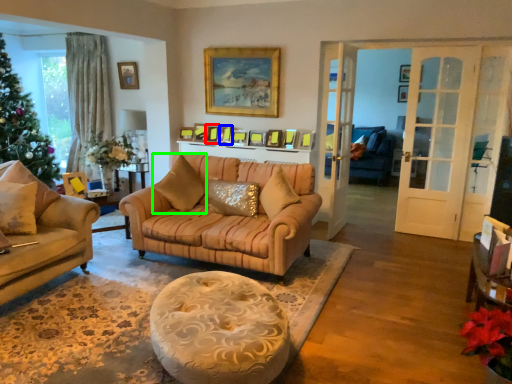
Question: Which is farther away from picture frame (highlighted by a red box)? picture frame (highlighted by a blue box) or pillow (highlighted by a green box)?

Choices:
 (A) picture frame
 (B) pillow

Answer: (B)